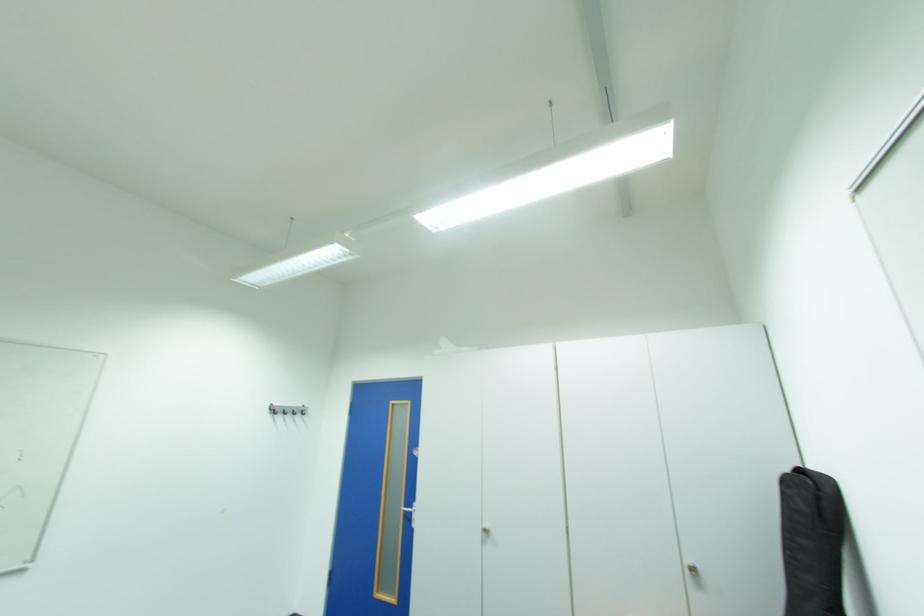
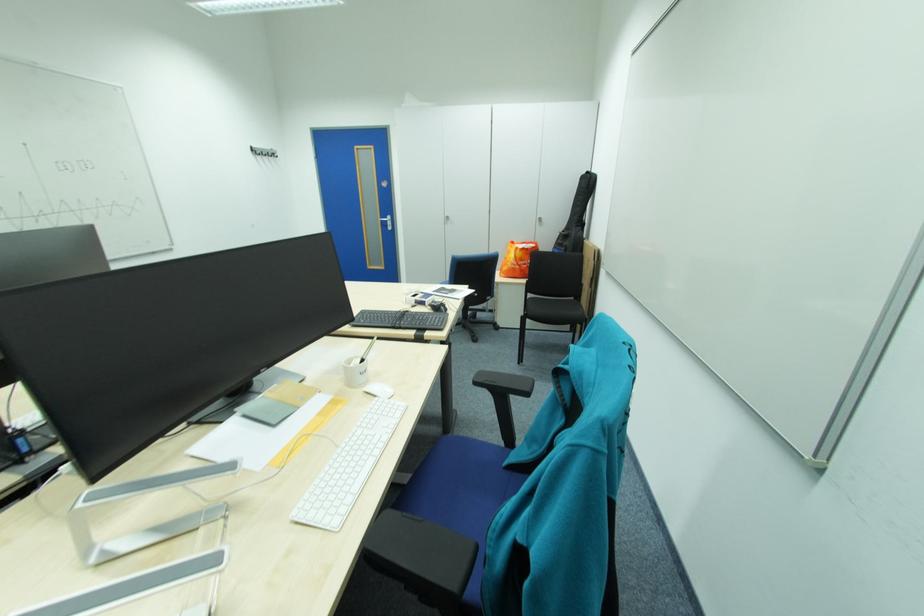
Find the pixel in the second image that matches [414,511] in the first image.

(390, 221)